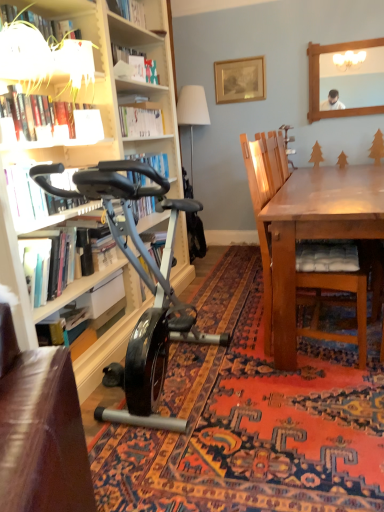
The width and height of the screenshot is (384, 512). In order to click on vacant space in front of wooden chair with cushion at right in this screenshot , I will do `click(309, 408)`.